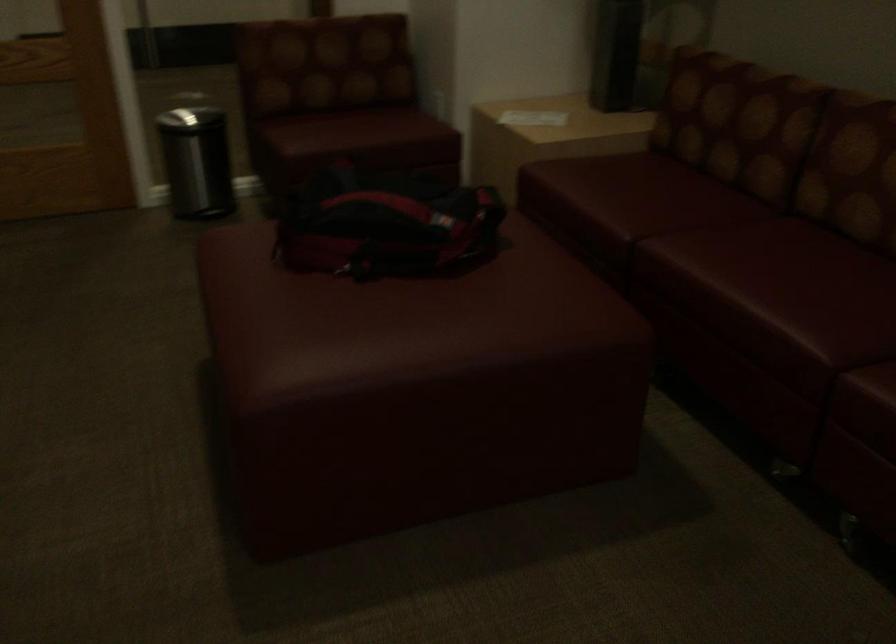
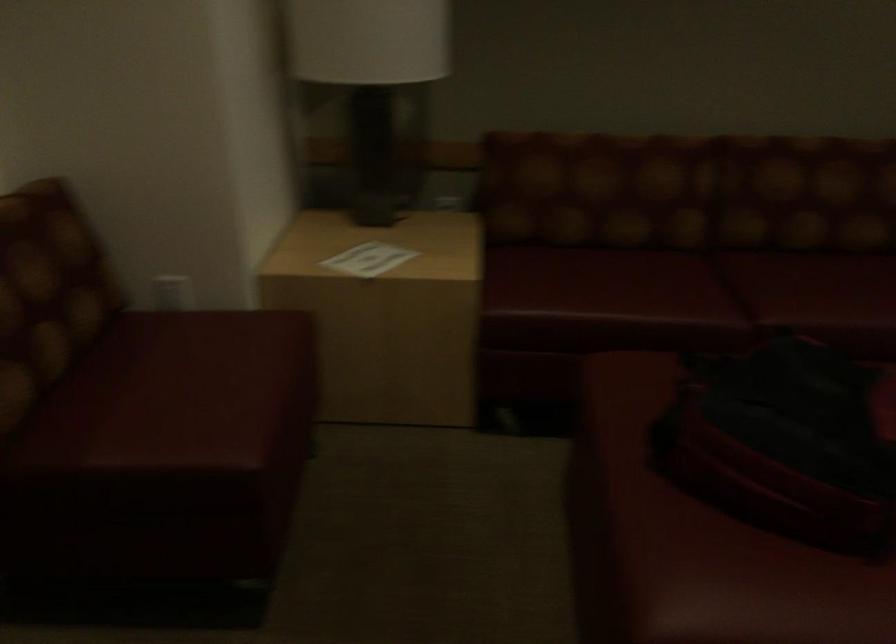
In the second image, find the point that corresponds to the point at 280,231 in the first image.

(693, 541)